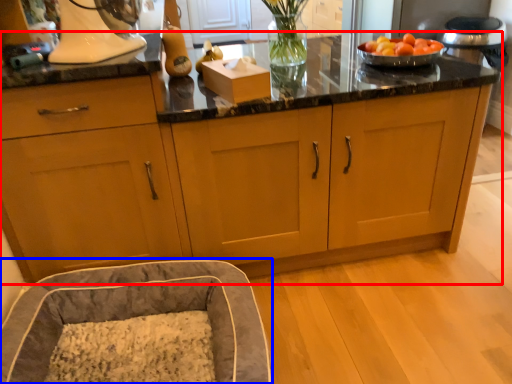
Question: Which point is closer to the camera, cabinetry (highlighted by a red box) or bean bag chair (highlighted by a blue box)?

Choices:
 (A) cabinetry
 (B) bean bag chair

Answer: (B)